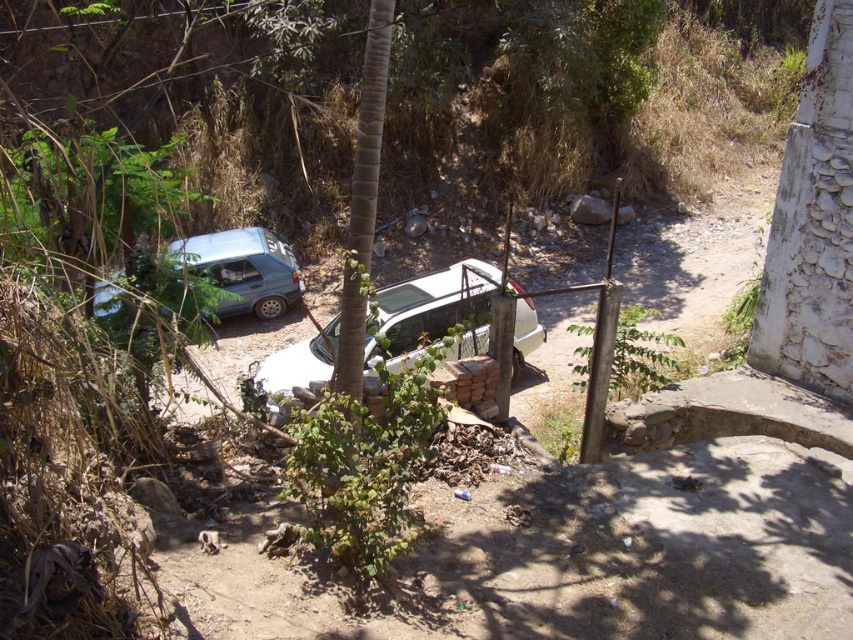
Question: Does green textured tree at center have a greater width compared to matte blue car at left?

Choices:
 (A) no
 (B) yes

Answer: (B)

Question: Which object appears closest to the camera in this image?

Choices:
 (A) white matte car at center
 (B) green textured tree at center

Answer: (B)

Question: Which object appears farthest from the camera in this image?

Choices:
 (A) green textured tree at center
 (B) matte blue car at left
 (C) white matte car at center

Answer: (C)

Question: Among these points, which one is nearest to the camera?

Choices:
 (A) (236, 269)
 (B) (466, 266)
 (C) (347, 227)

Answer: (B)

Question: Is white matte car at center to the left of green textured tree at center from the viewer's perspective?

Choices:
 (A) no
 (B) yes

Answer: (A)

Question: Does green textured tree at center lie behind matte blue car at left?

Choices:
 (A) yes
 (B) no

Answer: (B)